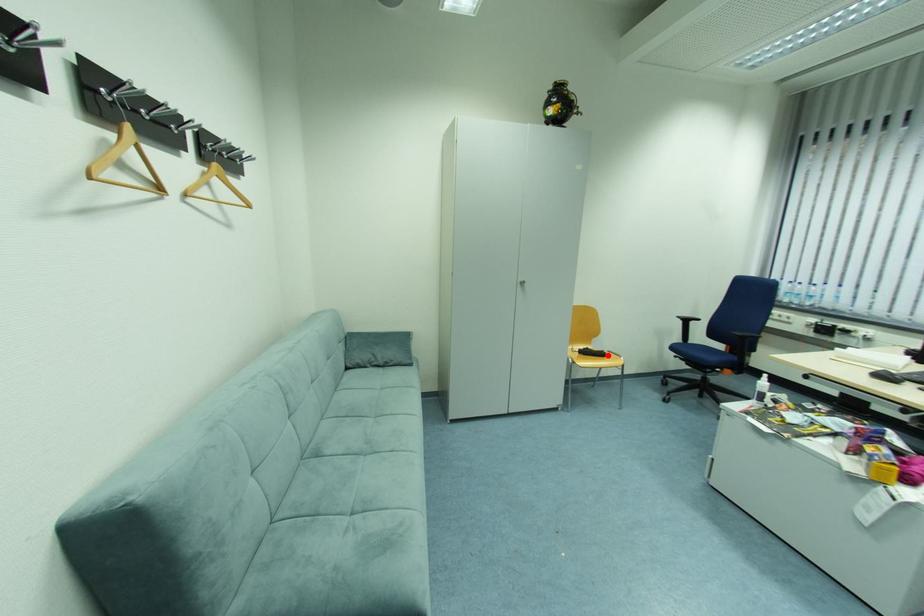
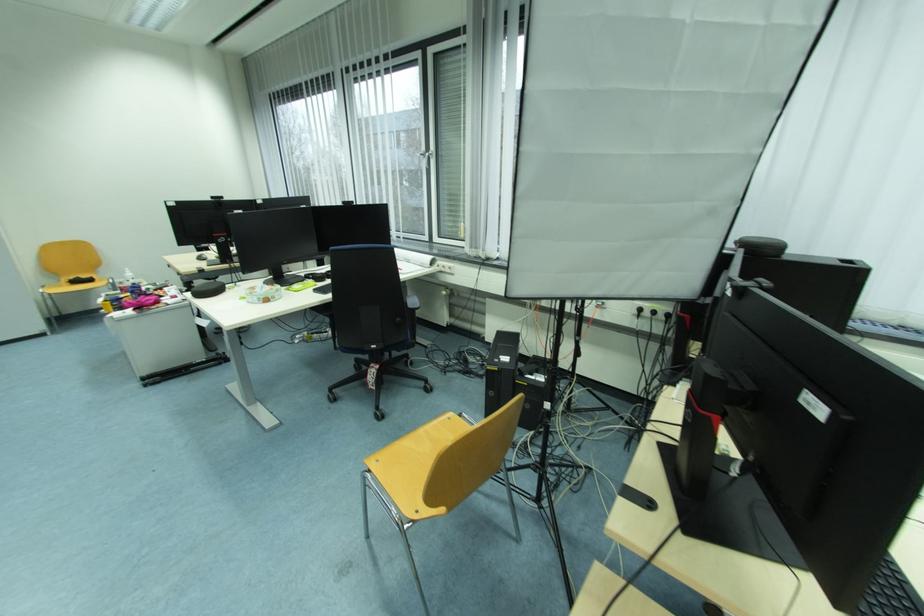
Question: I am providing you with two images of the same scene from different viewpoints. Given a red point in image1, look at the same physical point in image2. Is it:

Choices:
 (A) Closer to the viewpoint
 (B) Farther from the viewpoint

Answer: (B)